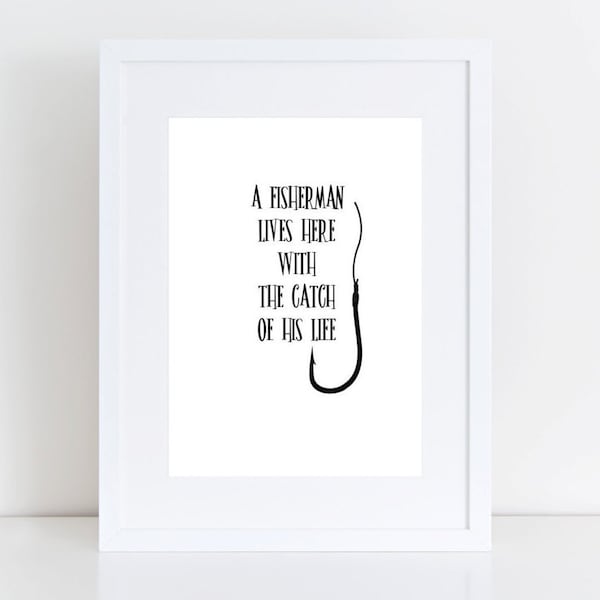
Locate an element on the screen. crack between shelf and wall is located at coordinates (52, 516), (76, 513), (516, 514), (564, 516).